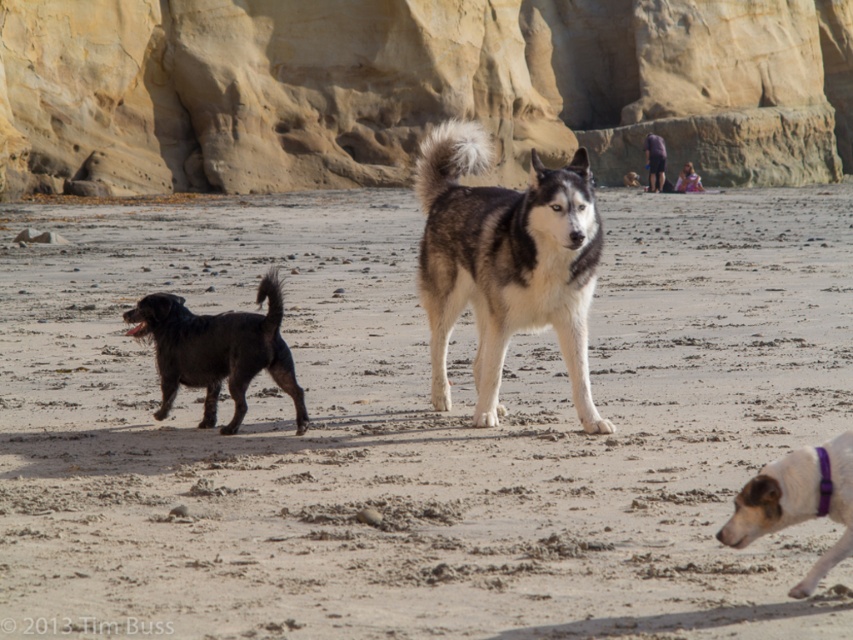
You are standing at the camera position and want to throw a ball to a point that is exactly 30 feet away. Is the point at coordinates point (480,324) within your target range?

The distance of point (480,324) from camera is 34.05 feet, which is beyond the 30 feet target range. Therefore, the point is out of reach for your throw.

You are a photographer at the beach scene and want to focus on the two points marked in the image. Which point, point (223, 448) or point (506, 202), is nearer to your camera lens?

Point (223, 448) is closer to the camera than point (506, 202).